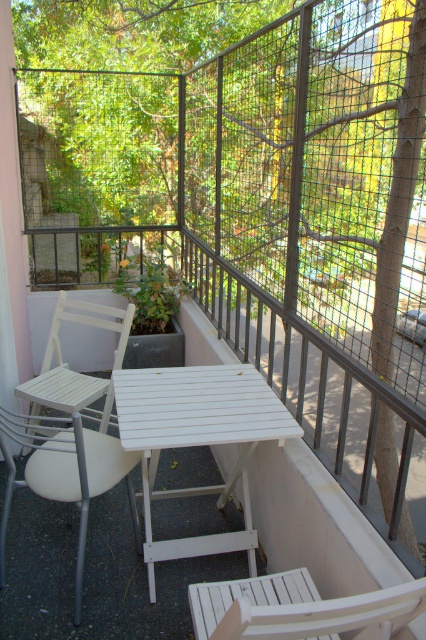
Who is more forward, (120,467) or (363,632)?

Point (363,632) is in front.

Consider the image. Does white plastic chair at left appear under white wood chair at lower center?

Correct, white plastic chair at left is located below white wood chair at lower center.

Find the location of a particular element. This screenshot has width=426, height=640. white plastic chair at left is located at coordinates (40, 464).

Is point (178, 496) positioned after point (0, 419)?

Yes, it is.

Who is shorter, white wood table at center or white plastic chair at left?

Standing shorter between the two is white plastic chair at left.

The width and height of the screenshot is (426, 640). What do you see at coordinates (198, 440) in the screenshot?
I see `white wood table at center` at bounding box center [198, 440].

Find the location of a particular element. The image size is (426, 640). white wood table at center is located at coordinates (198, 440).

What do you see at coordinates (40, 464) in the screenshot?
I see `white plastic chair at left` at bounding box center [40, 464].

Who is more forward, (62, 436) or (16, 387)?

Positioned in front is point (62, 436).

Where is `white plastic chair at left`? Image resolution: width=426 pixels, height=640 pixels. white plastic chair at left is located at coordinates (40, 464).

Locate an element on the screen. The height and width of the screenshot is (640, 426). white plastic chair at left is located at coordinates (x=40, y=464).